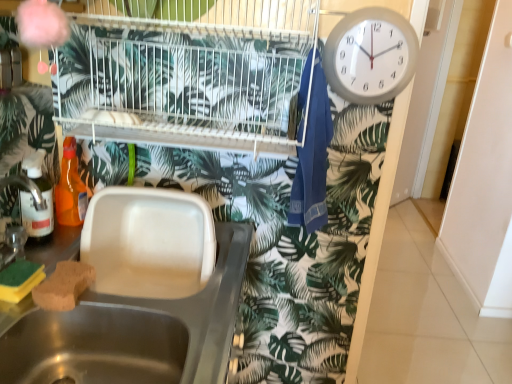
Question: Is the depth of brown sponge at sink left, which is counted as the first food, starting from the right, less than that of white glossy screen door at right?

Choices:
 (A) no
 (B) yes

Answer: (B)

Question: From a real-world perspective, is brown sponge at sink left, which is counted as the first food, starting from the right, located higher than white glossy screen door at right?

Choices:
 (A) no
 (B) yes

Answer: (B)

Question: Is brown sponge at sink left, which is counted as the first food, starting from the right, taller than white glossy screen door at right?

Choices:
 (A) no
 (B) yes

Answer: (A)

Question: Can you confirm if brown sponge at sink left, which ranks as the 2th food in left-to-right order, is wider than white glossy screen door at right?

Choices:
 (A) no
 (B) yes

Answer: (B)

Question: Is brown sponge at sink left, which ranks as the 2th food in left-to-right order, to the left of white glossy screen door at right from the viewer's perspective?

Choices:
 (A) no
 (B) yes

Answer: (B)

Question: Does brown sponge at sink left, which ranks as the 2th food in left-to-right order, have a lesser width compared to white glossy screen door at right?

Choices:
 (A) no
 (B) yes

Answer: (A)

Question: Is white wire bird cage at upper center aimed at translucent plastic bottle at left, the first bottle viewed from the front?

Choices:
 (A) no
 (B) yes

Answer: (A)

Question: Can you confirm if white wire bird cage at upper center is positioned to the left of translucent plastic bottle at left, the first bottle viewed from the front?

Choices:
 (A) yes
 (B) no

Answer: (B)

Question: Is white wire bird cage at upper center closer to the viewer compared to translucent plastic bottle at left, the first bottle viewed from the front?

Choices:
 (A) yes
 (B) no

Answer: (A)

Question: Is white wire bird cage at upper center smaller than translucent plastic bottle at left, which is the 2th bottle in back-to-front order?

Choices:
 (A) yes
 (B) no

Answer: (B)

Question: From a real-world perspective, is white wire bird cage at upper center physically above translucent plastic bottle at left, which is the 2th bottle in back-to-front order?

Choices:
 (A) yes
 (B) no

Answer: (A)

Question: Is white wire bird cage at upper center to the right of translucent plastic bottle at left, the first bottle viewed from the front, from the viewer's perspective?

Choices:
 (A) yes
 (B) no

Answer: (A)

Question: Can you confirm if translucent orange bottle at left, marked as the 1th bottle in a back-to-front arrangement, is bigger than green sponge at lower left, the first food when ordered from left to right?

Choices:
 (A) yes
 (B) no

Answer: (A)